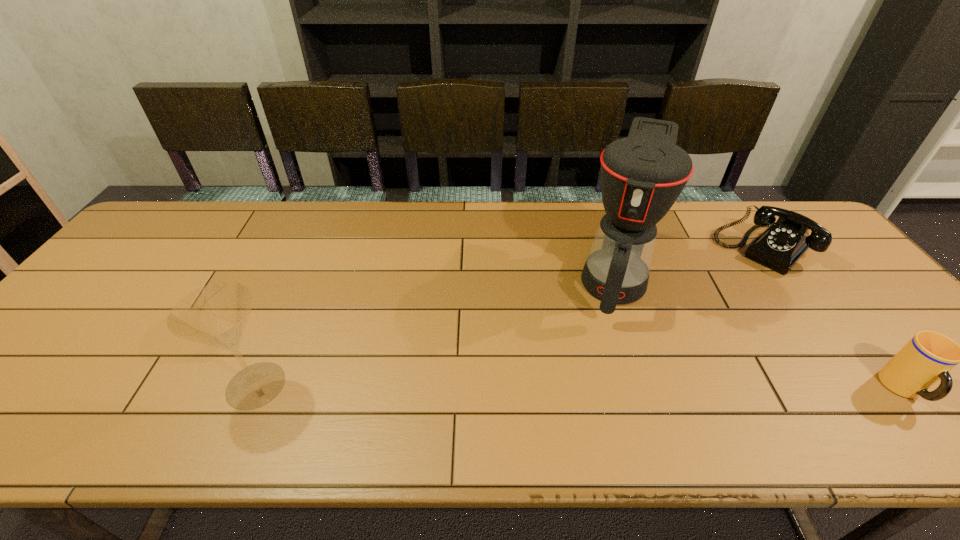
Where is `vacant point located between the cup and the leftmost object`? The width and height of the screenshot is (960, 540). vacant point located between the cup and the leftmost object is located at coordinates (580, 388).

Where is `free point between the coffee maker and the telephone`? The image size is (960, 540). free point between the coffee maker and the telephone is located at coordinates (689, 263).

Identify the location of vacant space that's between the coffee maker and the leftmost object. (436, 331).

Where is `vacant region between the tallest object and the third shortest object`? This screenshot has height=540, width=960. vacant region between the tallest object and the third shortest object is located at coordinates (436, 331).

At what (x,y) coordinates should I click in order to perform the action: click on vacant point located between the telephone and the third object from right to left. Please return your answer as a coordinate pair (x, y). The width and height of the screenshot is (960, 540). Looking at the image, I should click on (x=689, y=263).

Locate an element on the screen. Image resolution: width=960 pixels, height=540 pixels. object that stands as the closest to the telephone is located at coordinates (642, 175).

Point out which object is positioned as the third nearest to the coffee maker. Please provide its 2D coordinates. Your answer should be formatted as a tuple, i.e. [(x, y)], where the tuple contains the x and y coordinates of a point satisfying the conditions above.

[(215, 315)]

Identify the location of vacant space that satisfies the following two spatial constraints: 1. on the back side of the third object from right to left; 2. on the left side of the leftmost object. The image size is (960, 540). (302, 276).